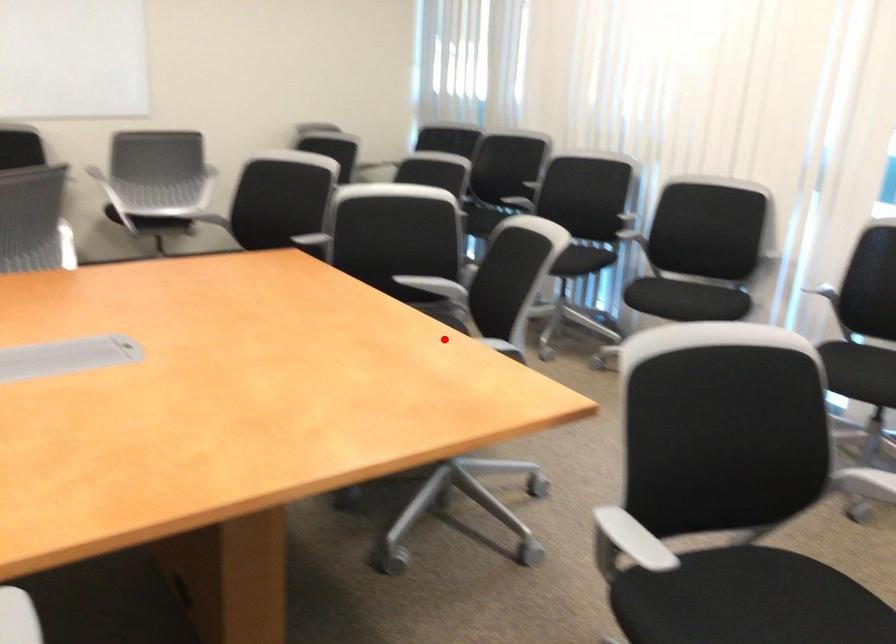
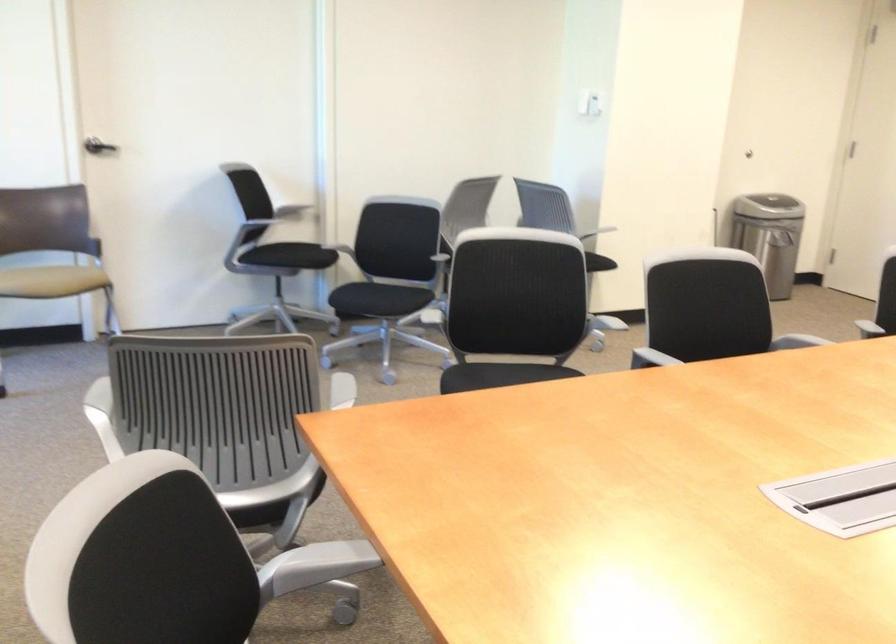
Question: I am providing you with two images of the same scene from different viewpoints. A red point is shown in image1. For the corresponding object point in image2, is it positioned nearer or farther from the camera?

Choices:
 (A) Nearer
 (B) Farther

Answer: (A)